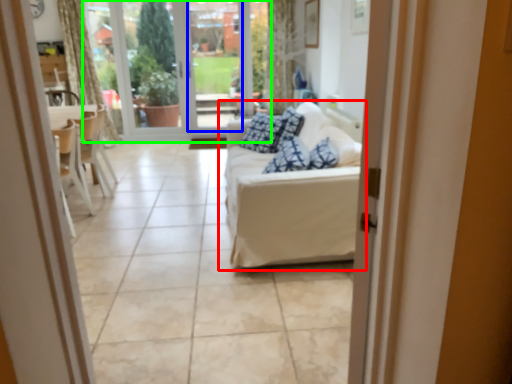
Question: Based on their relative distances, which object is nearer to studio couch (highlighted by a red box)? Choose from window screen (highlighted by a blue box) and bay window (highlighted by a green box).

Choices:
 (A) window screen
 (B) bay window

Answer: (A)